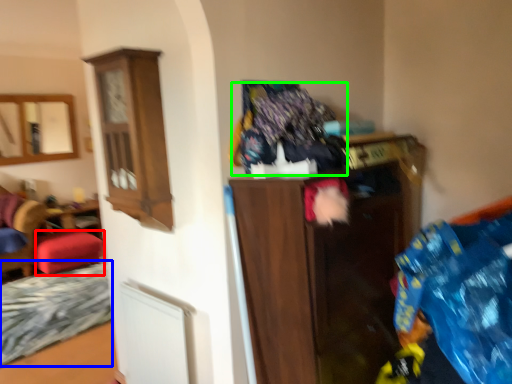
Question: Estimate the real-world distances between objects in this image. Which object is closer to stool (highlighted by a red box), bed frame (highlighted by a blue box) or laundry (highlighted by a green box)?

Choices:
 (A) bed frame
 (B) laundry

Answer: (A)